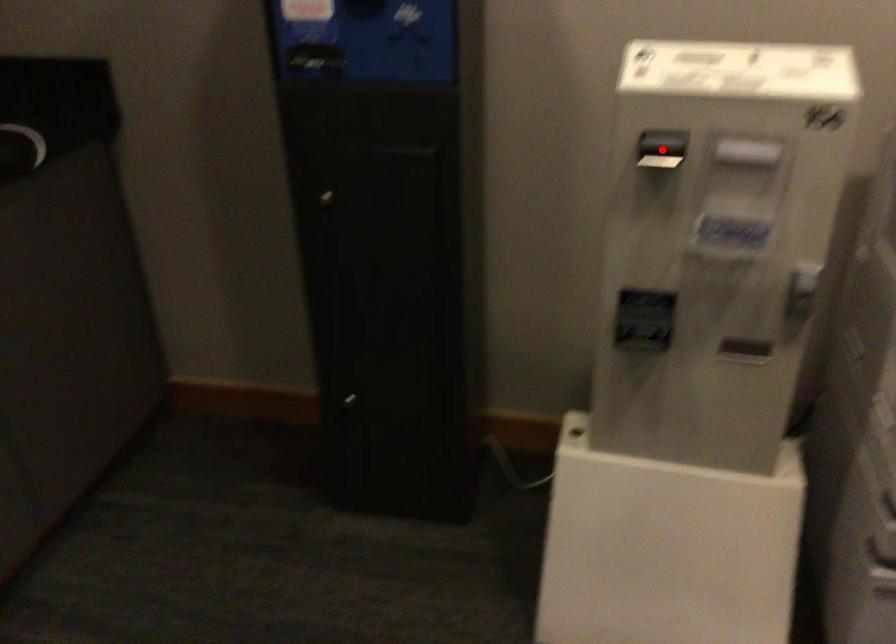
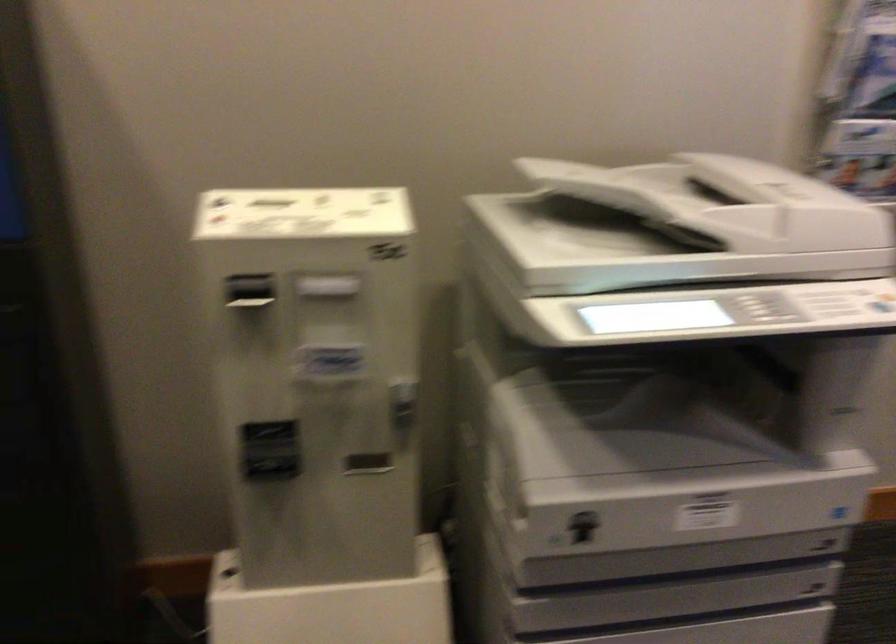
Find the pixel in the second image that matches the highlighted location in the first image.

(250, 292)